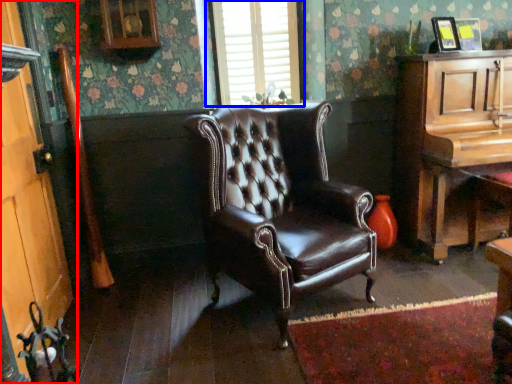
Question: Which object is closer to the camera taking this photo, door (highlighted by a red box) or window (highlighted by a blue box)?

Choices:
 (A) door
 (B) window

Answer: (A)